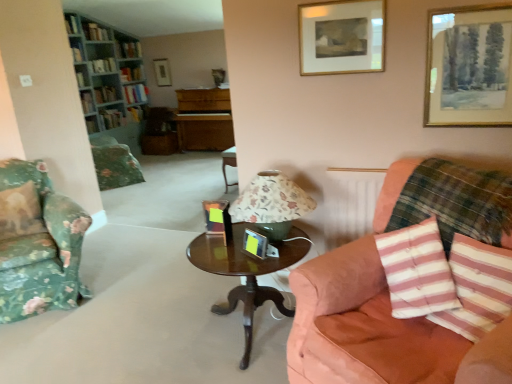
Identify the location of free location to the right of metallic gold picture frame at center, which appears as the fourth picture frame when viewed from the back. pos(289,254).